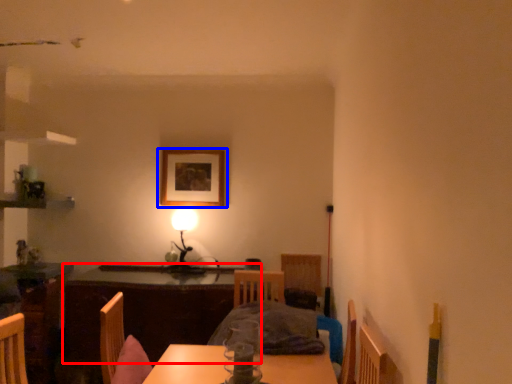
Question: Among these objects, which one is farthest to the camera, table (highlighted by a red box) or picture frame (highlighted by a blue box)?

Choices:
 (A) table
 (B) picture frame

Answer: (B)